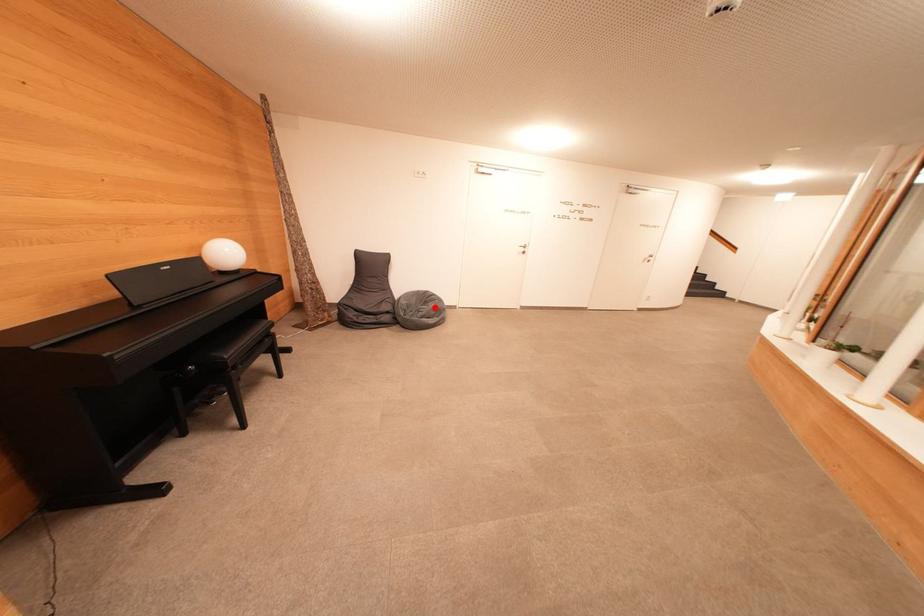
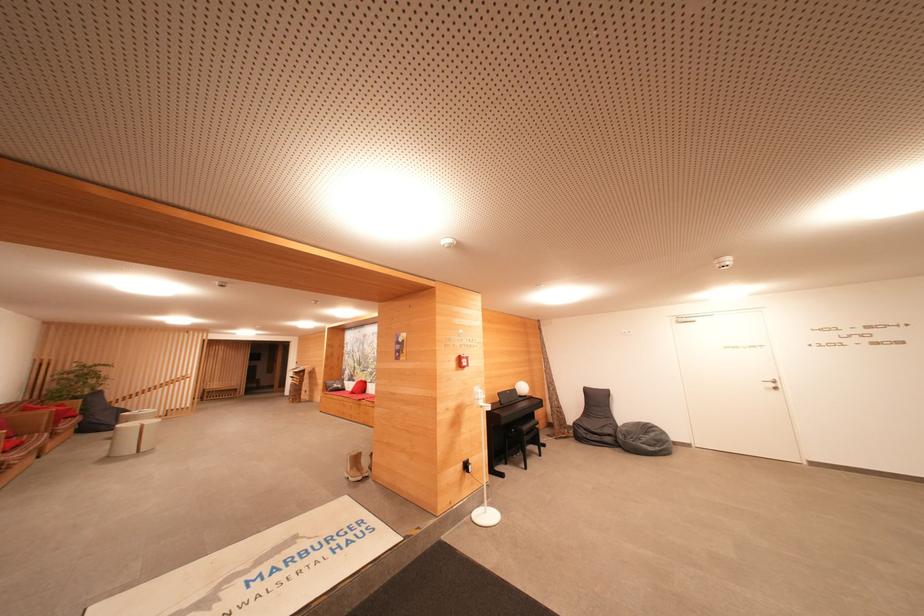
Question: I am providing you with two images of the same scene from different viewpoints. A red point is marked on the first image. At the location where the point appears in image 1, is it still visible in image 2?

Choices:
 (A) Yes
 (B) No

Answer: (A)